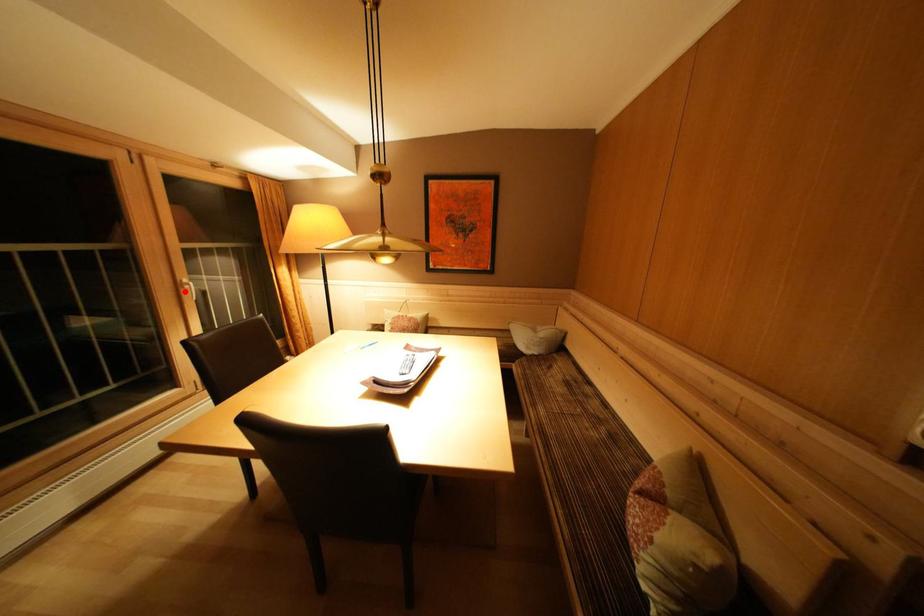
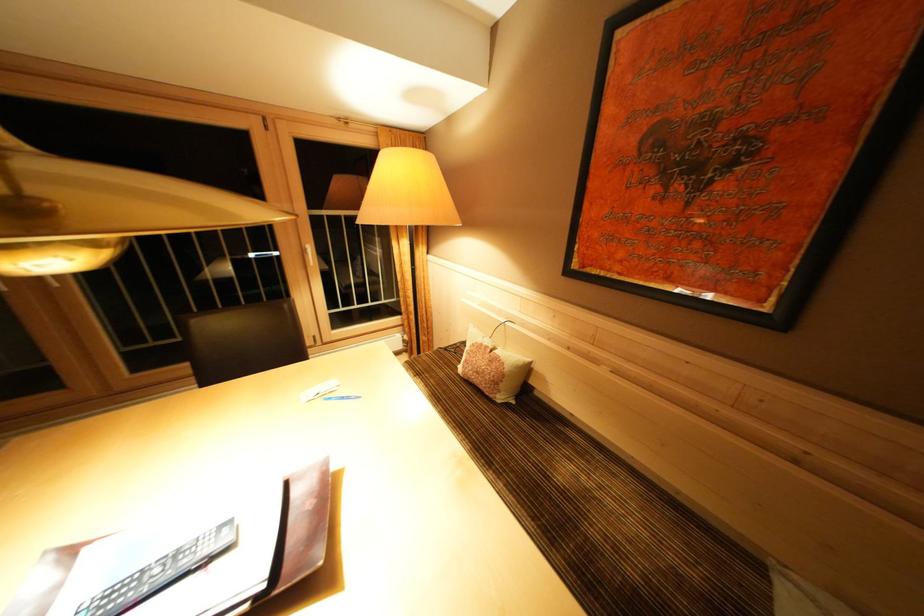
Find the pixel in the second image that matches the highlighted location in the first image.

(310, 256)